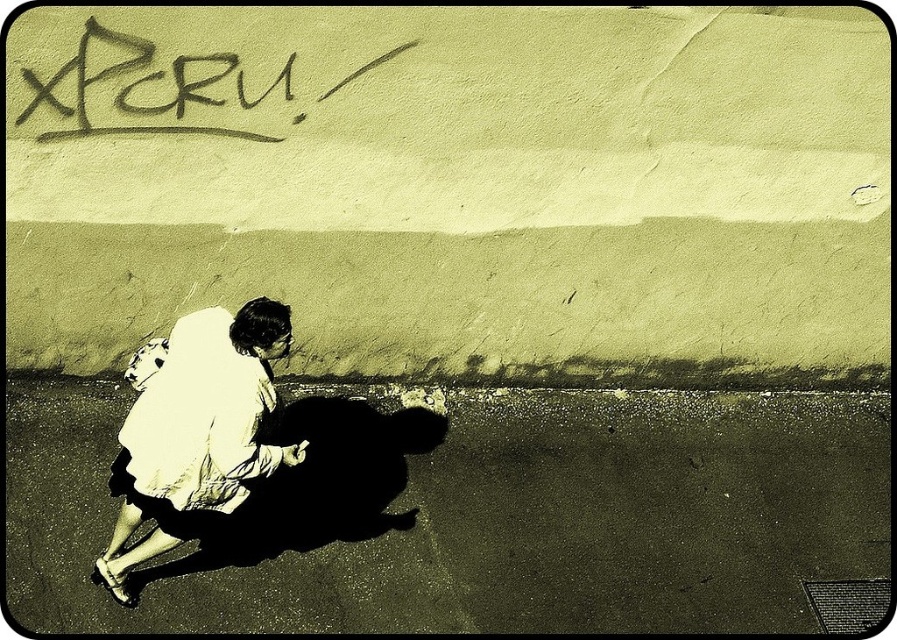
Question: Is white cotton shirt at lower left bigger than black graffiti at upper left?

Choices:
 (A) no
 (B) yes

Answer: (B)

Question: Which of the following is the farthest from the observer?

Choices:
 (A) white cotton shirt at lower left
 (B) dark asphalt pavement at lower left
 (C) black graffiti at upper left

Answer: (C)

Question: Which of the following is the closest to the observer?

Choices:
 (A) (101, 96)
 (B) (249, 387)
 (C) (629, 611)

Answer: (B)

Question: Which object is the farthest from the white cotton shirt at lower left?

Choices:
 (A) black graffiti at upper left
 (B) dark asphalt pavement at lower left

Answer: (A)

Question: Can you confirm if dark asphalt pavement at lower left is smaller than white cotton shirt at lower left?

Choices:
 (A) no
 (B) yes

Answer: (A)

Question: Is white cotton shirt at lower left bigger than black graffiti at upper left?

Choices:
 (A) yes
 (B) no

Answer: (A)